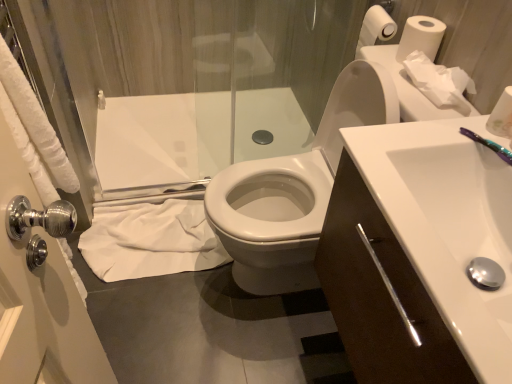
Question: Is the position of white paper roll at upper right, which is the first toilet paper from back to front, less distant than that of white glossy toilet at center?

Choices:
 (A) yes
 (B) no

Answer: (B)

Question: Does white paper roll at upper right, arranged as the first toilet paper when viewed from the top, appear on the right side of white glossy toilet at center?

Choices:
 (A) no
 (B) yes

Answer: (B)

Question: Is the surface of white paper roll at upper right, which ranks as the 4th toilet paper in bottom-to-top order, in direct contact with white glossy toilet at center?

Choices:
 (A) no
 (B) yes

Answer: (A)

Question: Can you confirm if white paper roll at upper right, arranged as the first toilet paper when viewed from the top, is positioned to the left of white glossy toilet at center?

Choices:
 (A) yes
 (B) no

Answer: (B)

Question: Is white paper roll at upper right, which ranks as the 4th toilet paper in bottom-to-top order, aimed at white glossy toilet at center?

Choices:
 (A) yes
 (B) no

Answer: (B)

Question: Is white paper roll at upper right, which is the first toilet paper from back to front, not close to white glossy toilet at center?

Choices:
 (A) yes
 (B) no

Answer: (B)

Question: Can you confirm if white glossy sink at center right is positioned to the left of white paper tissue at upper right, which appears as the 2th toilet paper when ordered from the bottom?

Choices:
 (A) yes
 (B) no

Answer: (A)

Question: Is white glossy sink at center right not close to white paper tissue at upper right, marked as the third toilet paper in a top-to-bottom arrangement?

Choices:
 (A) no
 (B) yes

Answer: (A)

Question: Considering the relative sizes of white glossy sink at center right and white paper tissue at upper right, positioned as the 3th toilet paper in back-to-front order, in the image provided, is white glossy sink at center right thinner than white paper tissue at upper right, positioned as the 3th toilet paper in back-to-front order,?

Choices:
 (A) yes
 (B) no

Answer: (B)

Question: Is white paper tissue at upper right, which appears as the 2th toilet paper when ordered from the bottom, completely or partially inside white glossy sink at center right?

Choices:
 (A) no
 (B) yes

Answer: (A)

Question: Can you confirm if white glossy sink at center right is taller than white paper tissue at upper right, the second toilet paper positioned from the front?

Choices:
 (A) yes
 (B) no

Answer: (A)

Question: Considering the relative positions of white glossy sink at center right and white paper tissue at upper right, which appears as the 2th toilet paper when ordered from the bottom, in the image provided, is white glossy sink at center right in front of white paper tissue at upper right, which appears as the 2th toilet paper when ordered from the bottom,?

Choices:
 (A) no
 (B) yes

Answer: (B)

Question: Is purple plastic toothbrush at upper right far from white glossy sink at center right?

Choices:
 (A) yes
 (B) no

Answer: (B)